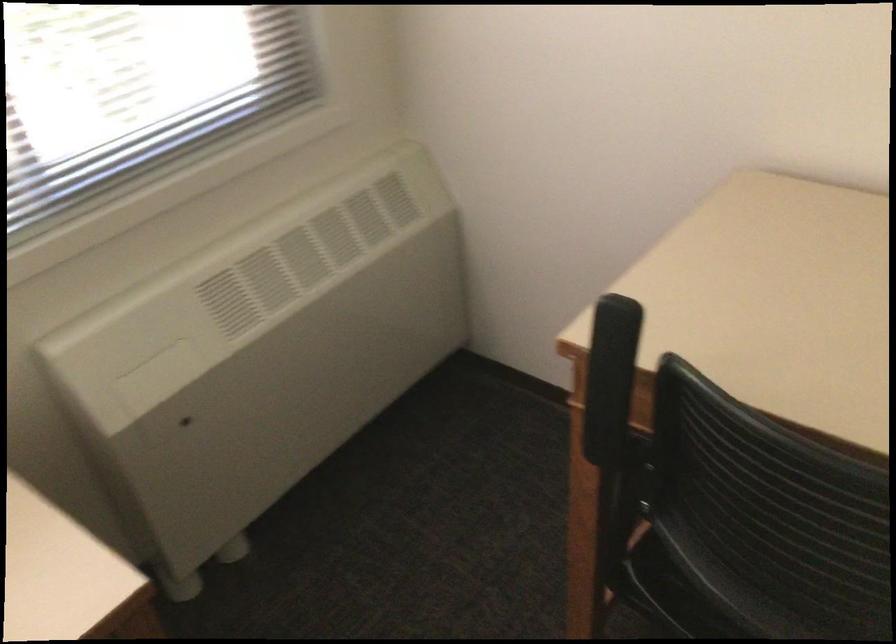
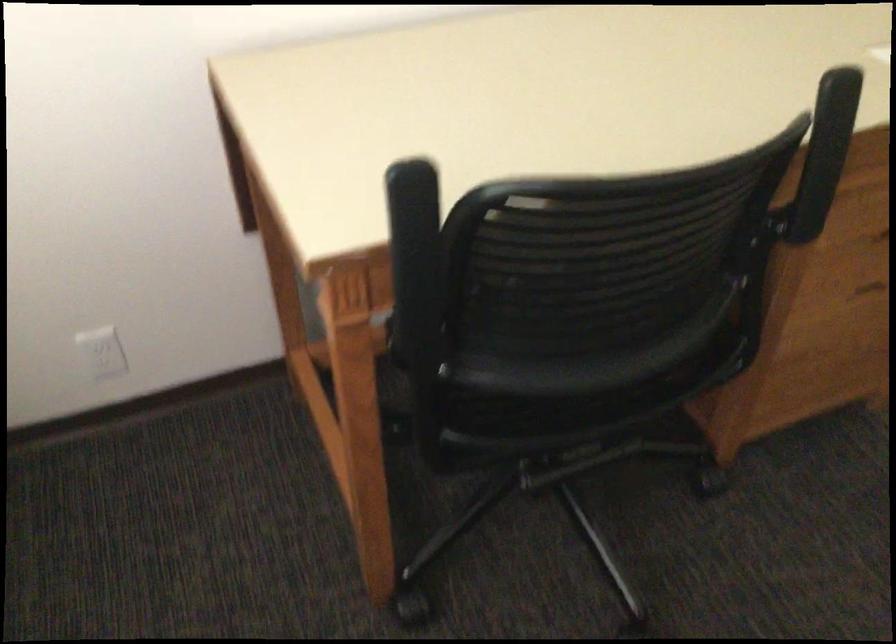
Where in the second image is the point corresponding to [619,368] from the first image?

(414, 238)